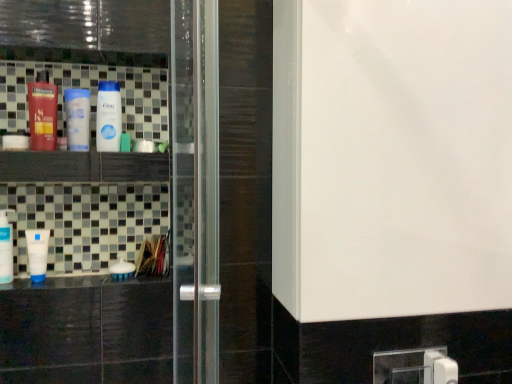
This screenshot has width=512, height=384. I want to click on vacant area that lies between white matte tube at lower left, which ranks as the fifth bottle in right-to-left order, and white matte bottle at center, positioned as the 1th bottle in right-to-left order, so click(x=80, y=278).